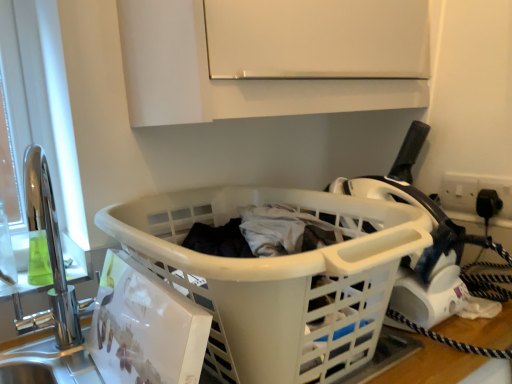
Question: From a real-world perspective, is white plastic laundry basket at center physically below white matte cabinet at upper center?

Choices:
 (A) yes
 (B) no

Answer: (A)

Question: Could you tell me if white plastic laundry basket at center is turned towards white matte cabinet at upper center?

Choices:
 (A) no
 (B) yes

Answer: (A)

Question: From the image's perspective, is white plastic laundry basket at center on top of white matte cabinet at upper center?

Choices:
 (A) yes
 (B) no

Answer: (B)

Question: Is white plastic laundry basket at center outside of white matte cabinet at upper center?

Choices:
 (A) yes
 (B) no

Answer: (A)

Question: Is white plastic laundry basket at center turned away from white matte cabinet at upper center?

Choices:
 (A) yes
 (B) no

Answer: (B)

Question: Is white plastic laundry basket at center positioned behind white matte cabinet at upper center?

Choices:
 (A) yes
 (B) no

Answer: (B)

Question: Would you say white matte cabinet at upper center is outside white plastic laundry basket at center?

Choices:
 (A) no
 (B) yes

Answer: (B)

Question: Is white matte cabinet at upper center facing towards white plastic laundry basket at center?

Choices:
 (A) yes
 (B) no

Answer: (B)

Question: Can you confirm if white matte cabinet at upper center is shorter than white plastic laundry basket at center?

Choices:
 (A) yes
 (B) no

Answer: (B)

Question: Does white matte cabinet at upper center have a lesser width compared to white plastic laundry basket at center?

Choices:
 (A) yes
 (B) no

Answer: (A)

Question: Are white matte cabinet at upper center and white plastic laundry basket at center far apart?

Choices:
 (A) no
 (B) yes

Answer: (A)

Question: Is white plastic laundry basket at center at the back of white matte cabinet at upper center?

Choices:
 (A) no
 (B) yes

Answer: (A)

Question: Considering their positions, is white plastic laundry basket at center located in front of or behind white matte cabinet at upper center?

Choices:
 (A) behind
 (B) front

Answer: (B)